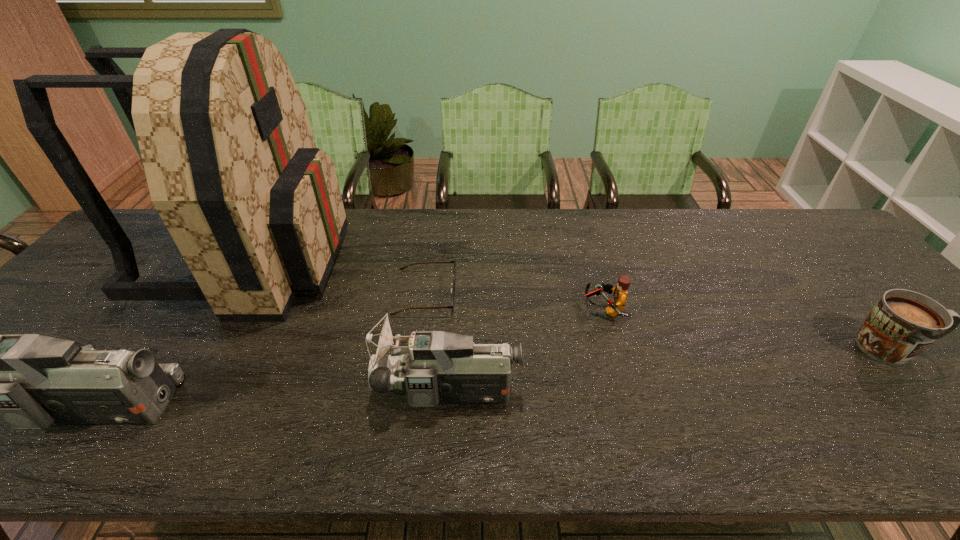
Please point a free position for a camcorder on the right. Please provide its 2D coordinates. Your answer should be formatted as a tuple, i.e. [(x, y)], where the tuple contains the x and y coordinates of a point satisfying the conditions above.

[(782, 375)]